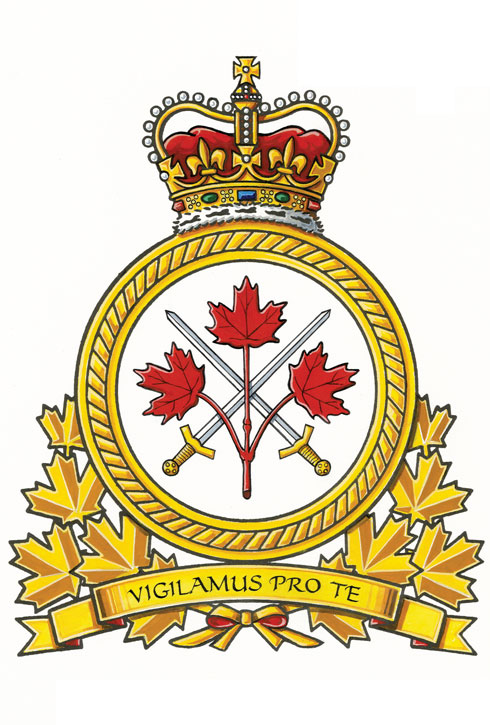
Where is `handle`? handle is located at coordinates (309, 455), (182, 454).